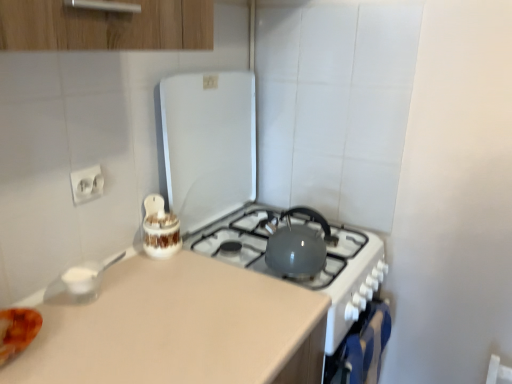
The image size is (512, 384). Describe the element at coordinates (87, 184) in the screenshot. I see `white glossy electric outlet at upper left` at that location.

Find the location of a particular element. This screenshot has height=384, width=512. blue fabric oven at lower right is located at coordinates (361, 348).

Measure the distance between matte gray kettle at center, acting as the first appliance starting from the right, and camera.

They are 3.57 feet apart.

The width and height of the screenshot is (512, 384). In order to click on white glossy electric outlet at upper left in this screenshot , I will do `click(87, 184)`.

Is white glossy electric outlet at upper left bigger or smaller than white glossy jar at center, arranged as the first appliance when viewed from the left?

white glossy electric outlet at upper left is smaller than white glossy jar at center, arranged as the first appliance when viewed from the left.

Can you confirm if white glossy electric outlet at upper left is taller than white glossy jar at center, positioned as the second appliance in right-to-left order?

In fact, white glossy electric outlet at upper left may be shorter than white glossy jar at center, positioned as the second appliance in right-to-left order.

Can you tell me how much blue fabric oven at lower right and white glossy electric outlet at upper left differ in facing direction?

0.95 degrees.

Does blue fabric oven at lower right have a lesser height compared to white glossy electric outlet at upper left?

In fact, blue fabric oven at lower right may be taller than white glossy electric outlet at upper left.

Is blue fabric oven at lower right next to white glossy electric outlet at upper left?

blue fabric oven at lower right and white glossy electric outlet at upper left are clearly separated.

Which object is closer to the camera taking this photo, blue fabric oven at lower right or white glossy electric outlet at upper left?

white glossy electric outlet at upper left is more forward.

Can you confirm if white glossy jar at center, positioned as the second appliance in right-to-left order, is shorter than matte gray kettle at center, acting as the first appliance starting from the right?

Correct, white glossy jar at center, positioned as the second appliance in right-to-left order, is not as tall as matte gray kettle at center, acting as the first appliance starting from the right.

How far apart are white glossy jar at center, arranged as the first appliance when viewed from the left, and matte gray kettle at center, acting as the first appliance starting from the right?

white glossy jar at center, arranged as the first appliance when viewed from the left, and matte gray kettle at center, acting as the first appliance starting from the right, are 12.41 inches apart from each other.

Between white glossy jar at center, arranged as the first appliance when viewed from the left, and matte gray kettle at center, placed as the second appliance when sorted from left to right, which one is positioned behind?

white glossy jar at center, arranged as the first appliance when viewed from the left, is more distant.

Where is `appliance behind the matte gray kettle at center, placed as the second appliance when sorted from left to right`? appliance behind the matte gray kettle at center, placed as the second appliance when sorted from left to right is located at coordinates (160, 229).

Is the position of matte gray kettle at center, placed as the second appliance when sorted from left to right, more distant than that of white glossy jar at center, positioned as the second appliance in right-to-left order?

No, it is not.

From the image's perspective, is matte gray kettle at center, acting as the first appliance starting from the right, above or below white glossy jar at center, positioned as the second appliance in right-to-left order?

Clearly, from the image's perspective, matte gray kettle at center, acting as the first appliance starting from the right, is above white glossy jar at center, positioned as the second appliance in right-to-left order.

Between matte gray kettle at center, acting as the first appliance starting from the right, and white glossy jar at center, arranged as the first appliance when viewed from the left, which one appears on the left side from the viewer's perspective?

From the viewer's perspective, white glossy jar at center, arranged as the first appliance when viewed from the left, appears more on the left side.

Does point (152, 213) appear closer or farther from the camera than point (74, 175)?

Point (152, 213) appears to be farther away from the viewer than point (74, 175).

From a real-world perspective, is white glossy jar at center, positioned as the second appliance in right-to-left order, beneath white glossy electric outlet at upper left?

Correct, in the physical world, white glossy jar at center, positioned as the second appliance in right-to-left order, is lower than white glossy electric outlet at upper left.

Measure the distance from white glossy jar at center, positioned as the second appliance in right-to-left order, to white glossy electric outlet at upper left.

white glossy jar at center, positioned as the second appliance in right-to-left order, and white glossy electric outlet at upper left are 8.55 inches apart.

How many degrees apart are the facing directions of white glossy jar at center, positioned as the second appliance in right-to-left order, and white glossy electric outlet at upper left?

white glossy jar at center, positioned as the second appliance in right-to-left order, and white glossy electric outlet at upper left are facing 0.0354 degrees away from each other.

Is blue fabric oven at lower right not near matte gray kettle at center, acting as the first appliance starting from the right?

No.

Locate an element on the screen. The image size is (512, 384). the 1st appliance to the left of the blue fabric oven at lower right, starting your count from the anchor is located at coordinates (206, 145).

Who is bigger, blue fabric oven at lower right or matte gray kettle at center, placed as the second appliance when sorted from left to right?

matte gray kettle at center, placed as the second appliance when sorted from left to right, is bigger.

Considering the relative sizes of blue fabric oven at lower right and matte gray kettle at center, acting as the first appliance starting from the right, in the image provided, is blue fabric oven at lower right taller than matte gray kettle at center, acting as the first appliance starting from the right,?

No, blue fabric oven at lower right is not taller than matte gray kettle at center, acting as the first appliance starting from the right.

Which of these two, white glossy jar at center, arranged as the first appliance when viewed from the left, or blue fabric oven at lower right, stands shorter?

white glossy jar at center, arranged as the first appliance when viewed from the left, is shorter.

In the scene shown: Between white glossy jar at center, positioned as the second appliance in right-to-left order, and blue fabric oven at lower right, which one is positioned in front?

Positioned in front is blue fabric oven at lower right.

Considering the relative sizes of white glossy jar at center, positioned as the second appliance in right-to-left order, and blue fabric oven at lower right in the image provided, is white glossy jar at center, positioned as the second appliance in right-to-left order, bigger than blue fabric oven at lower right?

No, white glossy jar at center, positioned as the second appliance in right-to-left order, is not bigger than blue fabric oven at lower right.

I want to click on electric outlet in front of the white glossy jar at center, arranged as the first appliance when viewed from the left, so click(87, 184).

In order to click on oven located on the right of white glossy electric outlet at upper left in this screenshot , I will do `click(361, 348)`.

Considering their positions, is white glossy jar at center, arranged as the first appliance when viewed from the left, positioned further to white glossy electric outlet at upper left than matte gray kettle at center, acting as the first appliance starting from the right?

matte gray kettle at center, acting as the first appliance starting from the right, is further to white glossy electric outlet at upper left.

When comparing their distances from white glossy jar at center, positioned as the second appliance in right-to-left order, does blue fabric oven at lower right or matte gray kettle at center, acting as the first appliance starting from the right, seem closer?

matte gray kettle at center, acting as the first appliance starting from the right, is positioned closer to the anchor white glossy jar at center, positioned as the second appliance in right-to-left order.

From the image, which object appears to be farther from matte gray kettle at center, placed as the second appliance when sorted from left to right, blue fabric oven at lower right or white glossy jar at center, positioned as the second appliance in right-to-left order?

Based on the image, blue fabric oven at lower right appears to be further to matte gray kettle at center, placed as the second appliance when sorted from left to right.

When comparing their distances from white glossy electric outlet at upper left, does blue fabric oven at lower right or matte gray kettle at center, acting as the first appliance starting from the right, seem further?

Among the two, blue fabric oven at lower right is located further to white glossy electric outlet at upper left.

Considering their positions, is white glossy electric outlet at upper left positioned further to blue fabric oven at lower right than white glossy jar at center, arranged as the first appliance when viewed from the left?

white glossy electric outlet at upper left is further to blue fabric oven at lower right.

When comparing their distances from blue fabric oven at lower right, does white glossy electric outlet at upper left or matte gray kettle at center, acting as the first appliance starting from the right, seem further?

The object further to blue fabric oven at lower right is white glossy electric outlet at upper left.

Based on their spatial positions, is white glossy jar at center, arranged as the first appliance when viewed from the left, or blue fabric oven at lower right further from matte gray kettle at center, placed as the second appliance when sorted from left to right?

Based on the image, blue fabric oven at lower right appears to be further to matte gray kettle at center, placed as the second appliance when sorted from left to right.

Which object lies further to the anchor point blue fabric oven at lower right, matte gray kettle at center, acting as the first appliance starting from the right, or white glossy electric outlet at upper left?

The object further to blue fabric oven at lower right is white glossy electric outlet at upper left.

This screenshot has height=384, width=512. I want to click on appliance between white glossy electric outlet at upper left and matte gray kettle at center, acting as the first appliance starting from the right, from left to right, so click(x=160, y=229).

The height and width of the screenshot is (384, 512). What are the coordinates of `appliance between matte gray kettle at center, acting as the first appliance starting from the right, and blue fabric oven at lower right in the up-down direction` in the screenshot? It's located at (160, 229).